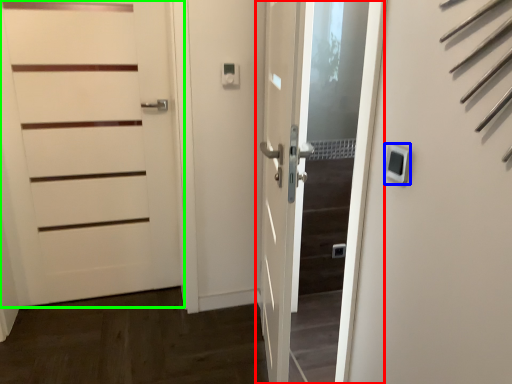
Question: Considering the real-world distances, which object is closest to door (highlighted by a red box)? thermostat (highlighted by a blue box) or door (highlighted by a green box).

Choices:
 (A) thermostat
 (B) door

Answer: (A)